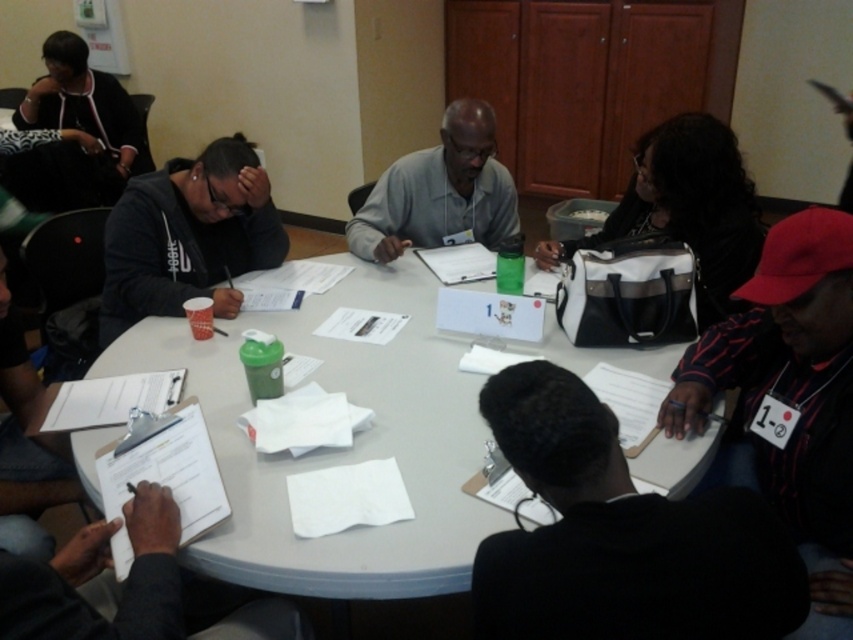
Question: Considering the relative positions of white fabric bag at upper right and gray matte shirt at center in the image provided, where is white fabric bag at upper right located with respect to gray matte shirt at center?

Choices:
 (A) left
 (B) right

Answer: (B)

Question: Which point is farther to the camera?

Choices:
 (A) (660, 154)
 (B) (15, 177)

Answer: (B)

Question: Which of the following is the farthest from the observer?

Choices:
 (A) gray matte shirt at center
 (B) matte black hoodie at left

Answer: (A)

Question: Which object is the farthest from the matte black jacket at upper left?

Choices:
 (A) gray matte shirt at center
 (B) white paper at center
 (C) matte black hoodie at left
 (D) white fabric bag at upper right

Answer: (D)

Question: Observing the image, what is the correct spatial positioning of matte black hoodie at left in reference to matte black jacket at upper left?

Choices:
 (A) right
 (B) left

Answer: (A)

Question: Can you confirm if matte black hoodie at left is smaller than gray matte shirt at center?

Choices:
 (A) no
 (B) yes

Answer: (B)